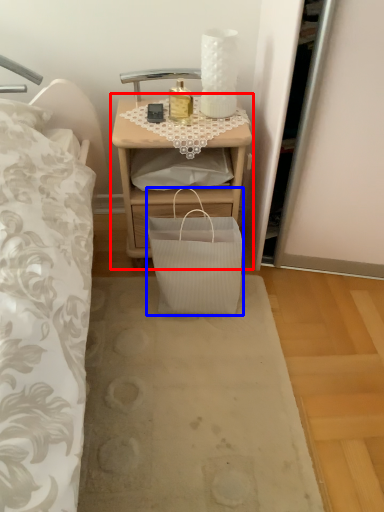
Question: Which object appears closest to the camera in this image, nightstand (highlighted by a red box) or bag (highlighted by a blue box)?

Choices:
 (A) nightstand
 (B) bag

Answer: (B)